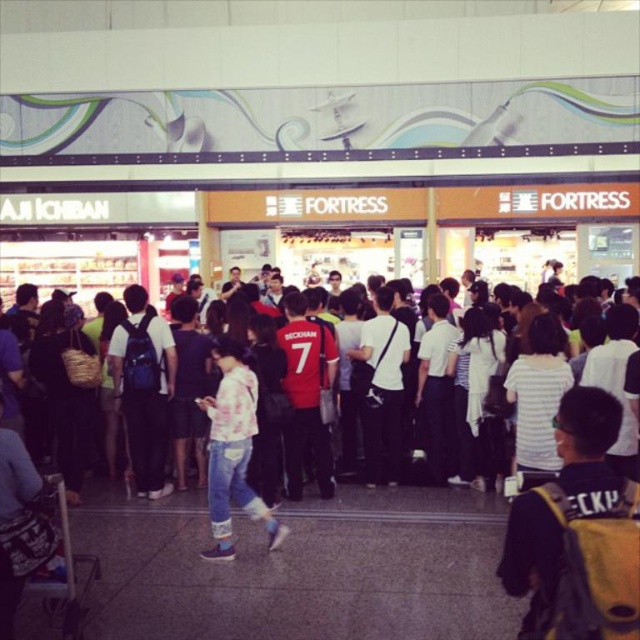
Question: Is light pink cotton shirt at center bigger than white matte shirt at center?

Choices:
 (A) yes
 (B) no

Answer: (B)

Question: Among these objects, which one is farthest from the camera?

Choices:
 (A) light pink cotton shirt at center
 (B) matte blue backpack at center
 (C) white cotton shirt at center
 (D) white matte shirt at center

Answer: (D)

Question: Which point appears closest to the camera in this image?

Choices:
 (A) (120, 362)
 (B) (369, 461)
 (C) (616, 632)

Answer: (C)

Question: Does light pink cotton shirt at center have a greater width compared to white cotton shirt at center?

Choices:
 (A) yes
 (B) no

Answer: (B)

Question: Which object is the closest to the white cotton shirt at center?

Choices:
 (A) matte blue backpack at center
 (B) white matte shirt at center

Answer: (B)

Question: Does matte blue backpack at center appear over white cotton shirt at center?

Choices:
 (A) no
 (B) yes

Answer: (B)